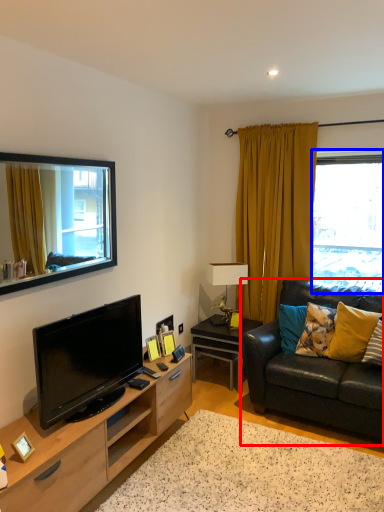
Question: Which of the following is the closest to the observer, studio couch (highlighted by a red box) or window (highlighted by a blue box)?

Choices:
 (A) studio couch
 (B) window

Answer: (A)